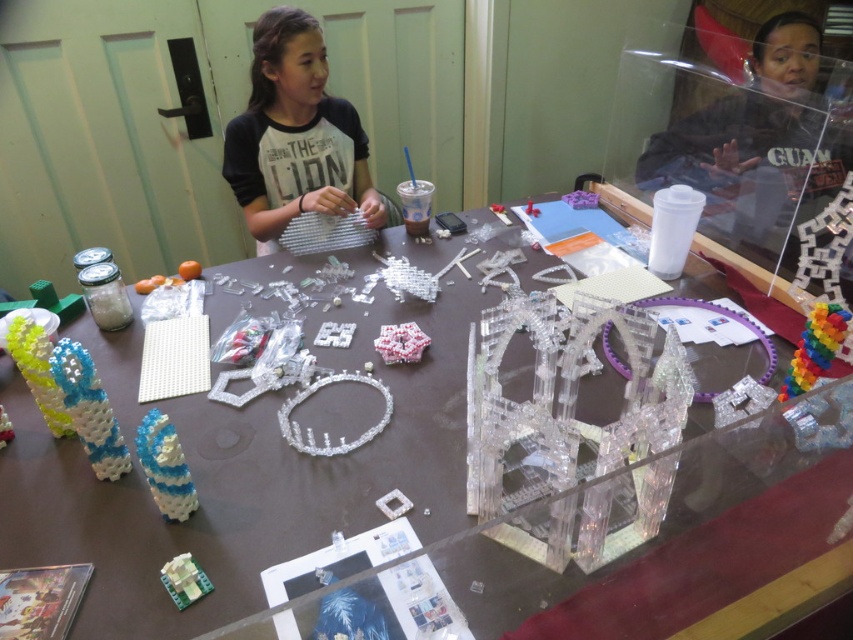
You are a participant in the activity and want to place a new piece on the translucent plastic cube at center. Can you reach it directly from your current position at the clear plastic table at center?

The clear plastic table at center is closer to the viewer than the translucent plastic cube at center, so yes, you can reach the translucent plastic cube at center from the clear plastic table at center as it is further away but within reach.

You are a guest in the room and want to place a small object on the clear plastic table at center without it falling off. Considering the position of the matte black shirt at upper center, where should you place the object?

Answer: You should place the small object on the clear plastic table at center away from the edge nearest the matte black shirt at upper center to prevent it from falling off, as the table is positioned under the shirt, which might obstruct items placed near that edge.

You have a rectangular box that is 20 cm wide. You need to place both the clear plastic table at center and the rainbow plastic toy at right inside it. Can you fit both items side by side without overlapping?

The clear plastic table at center is wider than the rainbow plastic toy at right. Since the box is only 20 cm wide, if the combined width of both items exceeds 20 cm, they won